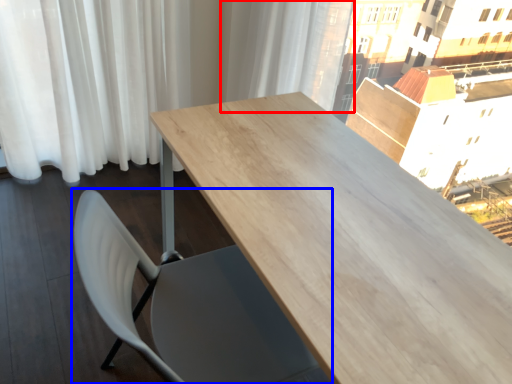
Question: Which object appears farthest to the camera in this image, curtain (highlighted by a red box) or chair (highlighted by a blue box)?

Choices:
 (A) curtain
 (B) chair

Answer: (A)